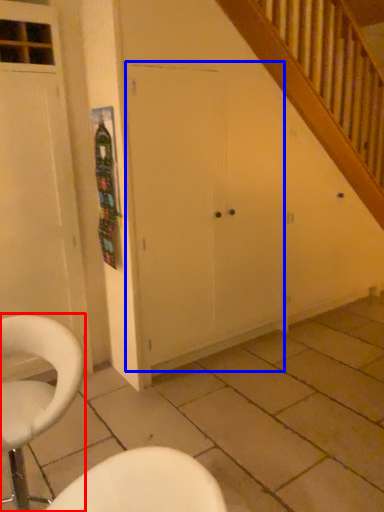
Question: Which of the following is the farthest to the observer, chair (highlighted by a red box) or screen door (highlighted by a blue box)?

Choices:
 (A) chair
 (B) screen door

Answer: (B)